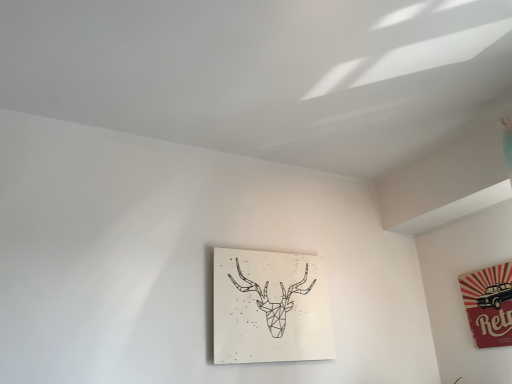
Measure the distance between white paper deer head at center and camera.

5.12 feet.

I want to click on white paper deer head at center, so click(x=273, y=302).

This screenshot has height=384, width=512. What do you see at coordinates (273, 302) in the screenshot?
I see `white paper deer head at center` at bounding box center [273, 302].

Where is `white paper deer head at center`? The height and width of the screenshot is (384, 512). white paper deer head at center is located at coordinates (273, 302).